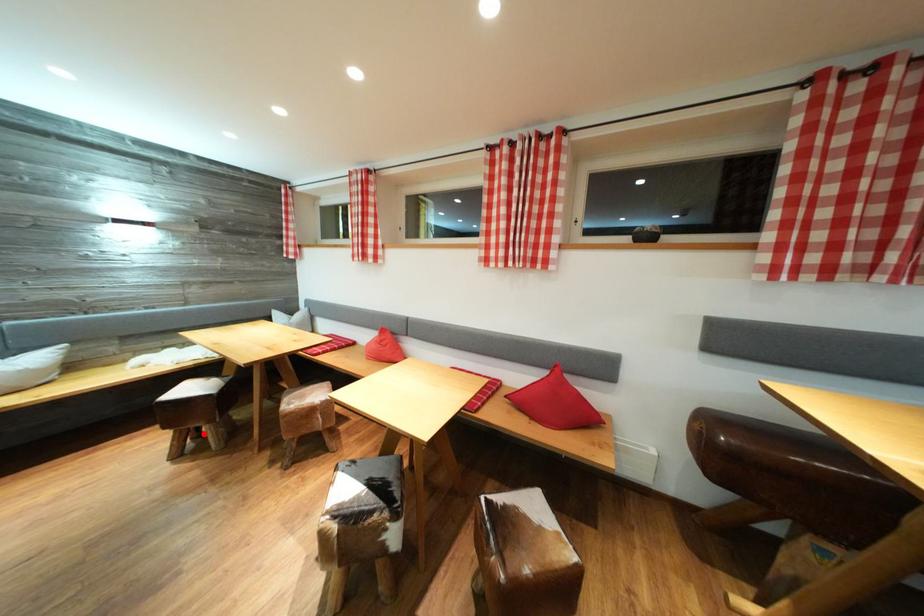
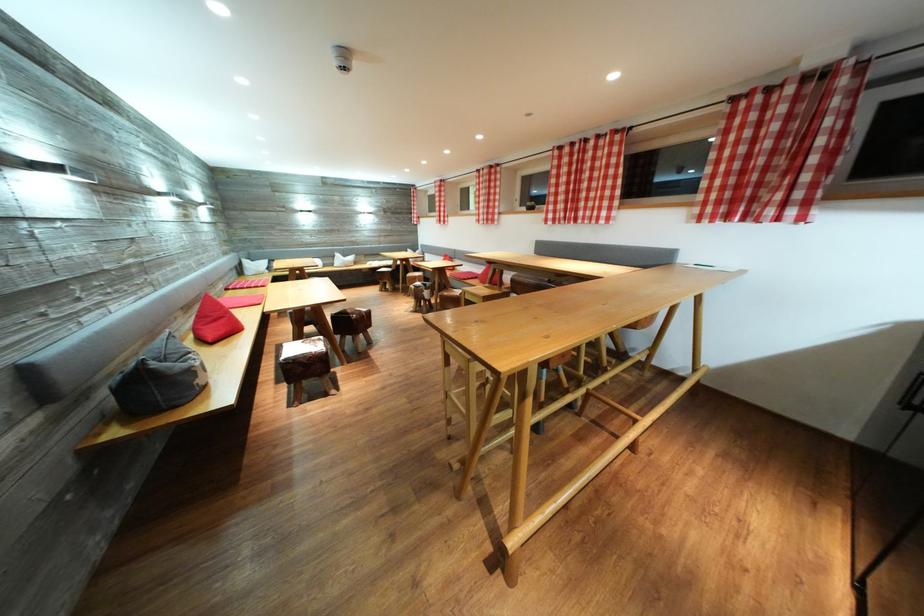
In the second image, find the point that corresponds to the highlighted location in the first image.

(393, 289)